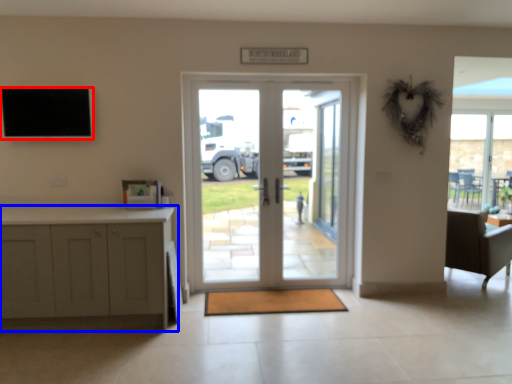
Question: Among these objects, which one is farthest to the camera, screen (highlighted by a red box) or cabinetry (highlighted by a blue box)?

Choices:
 (A) screen
 (B) cabinetry

Answer: (A)